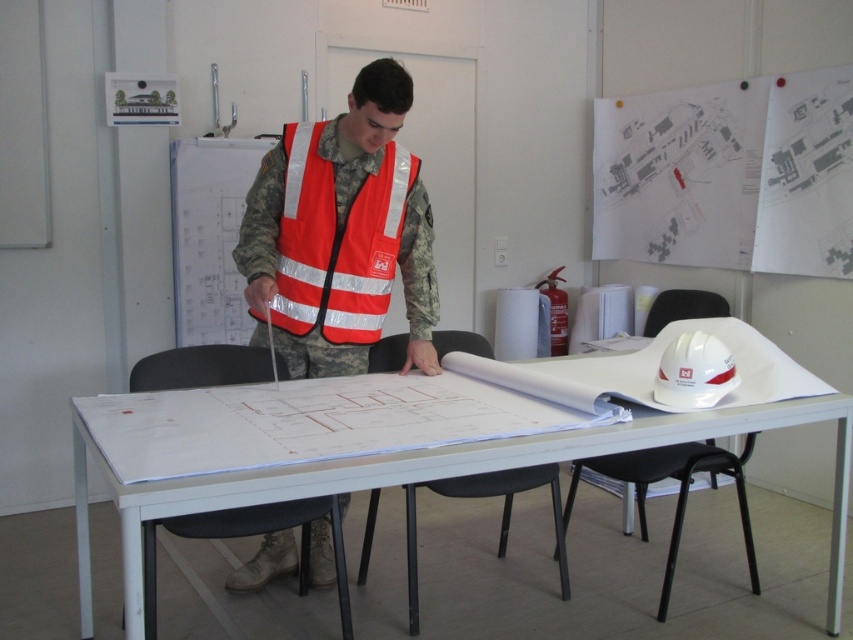
Is orange reflective vest at center bigger than white matte hard hat at upper right?

Indeed, orange reflective vest at center has a larger size compared to white matte hard hat at upper right.

The width and height of the screenshot is (853, 640). Identify the location of orange reflective vest at center. (340, 236).

What do you see at coordinates (260, 228) in the screenshot?
I see `reflective orange safety vest at center` at bounding box center [260, 228].

Between point (265, 164) and point (700, 396), which one is positioned in front?

Positioned in front is point (700, 396).

Image resolution: width=853 pixels, height=640 pixels. What do you see at coordinates (260, 228) in the screenshot?
I see `reflective orange safety vest at center` at bounding box center [260, 228].

Locate an element on the screen. This screenshot has width=853, height=640. reflective orange safety vest at center is located at coordinates (260, 228).

Does orange reflective vest at center come behind reflective orange safety vest at center?

No, orange reflective vest at center is closer to the viewer.

Measure the distance between orange reflective vest at center and reflective orange safety vest at center.

orange reflective vest at center and reflective orange safety vest at center are 4.04 centimeters apart.

Locate an element on the screen. This screenshot has width=853, height=640. orange reflective vest at center is located at coordinates (340, 236).